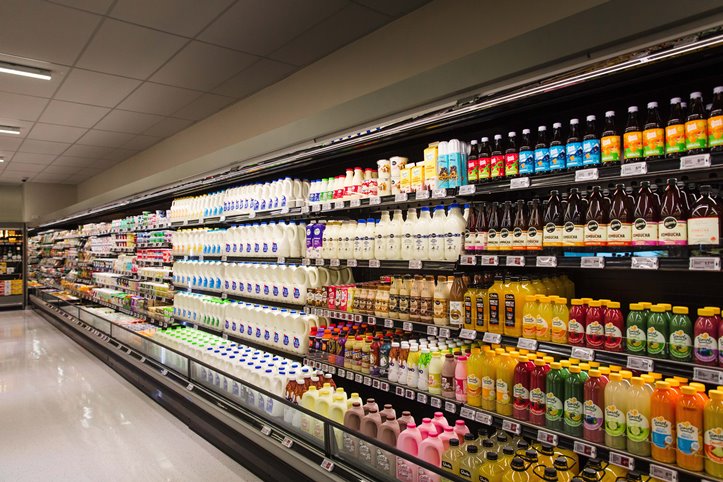
At what (x,y) coordinates should I click in order to perform the action: click on security camera. Please return your answer as a coordinate pair (x, y). The height and width of the screenshot is (482, 723). Looking at the image, I should click on (22, 182).